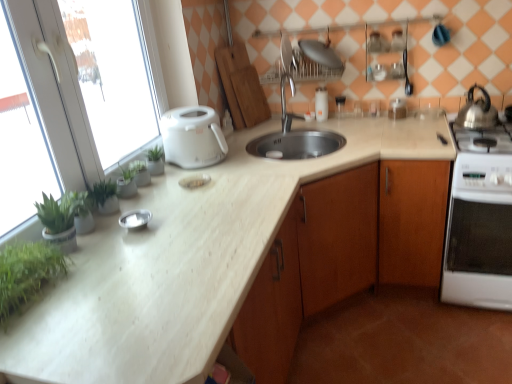
Find the location of a particular element. Image resolution: width=512 pixels, height=384 pixels. empty space that is to the right of green leafy plant at left is located at coordinates coord(101,283).